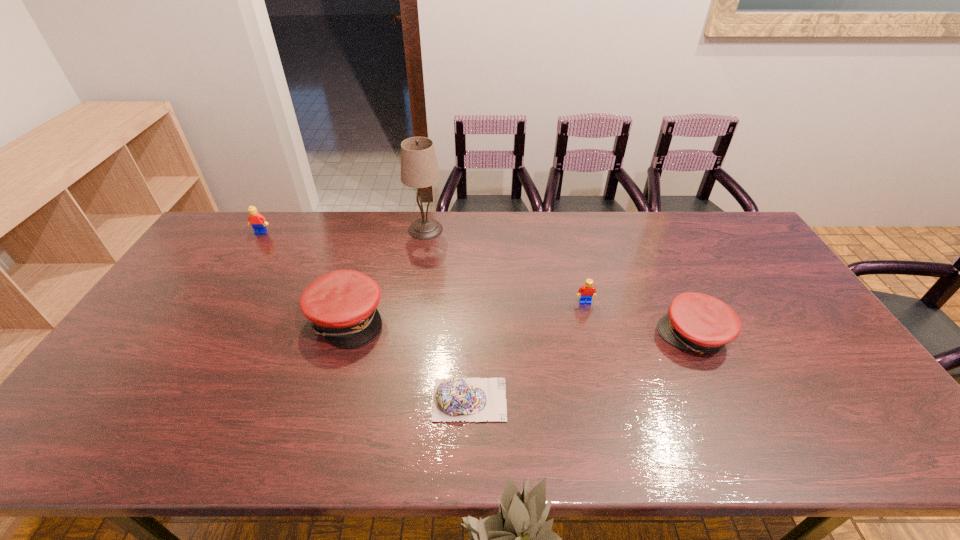
This screenshot has width=960, height=540. In order to click on the closest cap to the second tallest cap in this screenshot , I will do `click(472, 399)`.

Point out which cap is positioned as the third nearest to the left Lego. Please provide its 2D coordinates. Your answer should be formatted as a tuple, i.e. [(x, y)], where the tuple contains the x and y coordinates of a point satisfying the conditions above.

[(695, 321)]